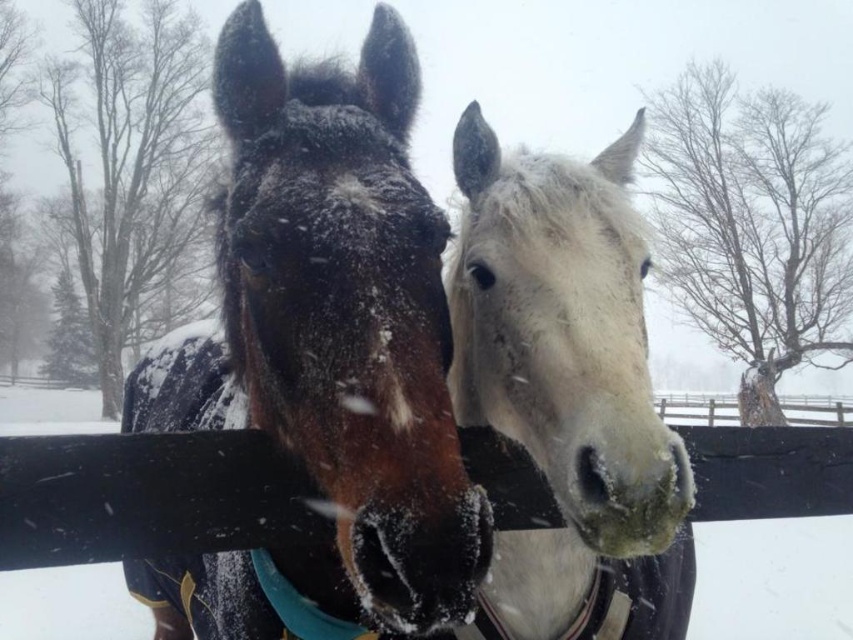
Question: Can you confirm if shiny brown horse at center is positioned to the left of white matte horse at center?

Choices:
 (A) yes
 (B) no

Answer: (A)

Question: Which point is farther to the camera?

Choices:
 (A) (561, 486)
 (B) (457, 522)

Answer: (A)

Question: Is shiny brown horse at center in front of white matte horse at center?

Choices:
 (A) yes
 (B) no

Answer: (A)

Question: Can you confirm if shiny brown horse at center is thinner than white matte horse at center?

Choices:
 (A) yes
 (B) no

Answer: (B)

Question: Among these objects, which one is farthest from the camera?

Choices:
 (A) shiny brown horse at center
 (B) white matte horse at center

Answer: (B)